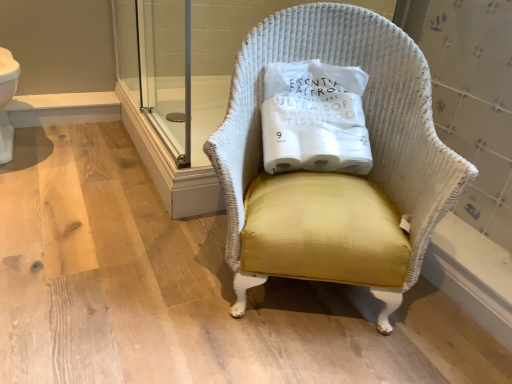
In order to click on free point to the left of white wicker chair at center in this screenshot , I will do `click(124, 258)`.